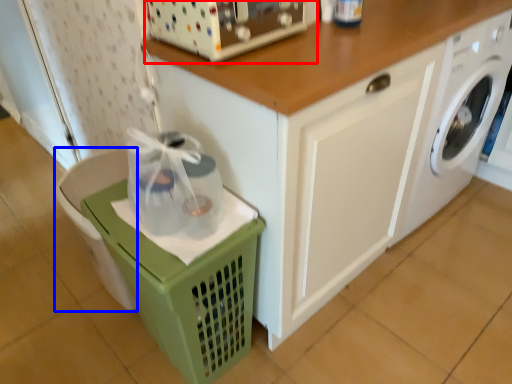
Question: Among these objects, which one is nearest to the camera, appliance (highlighted by a red box) or dish washer (highlighted by a blue box)?

Choices:
 (A) appliance
 (B) dish washer

Answer: (A)